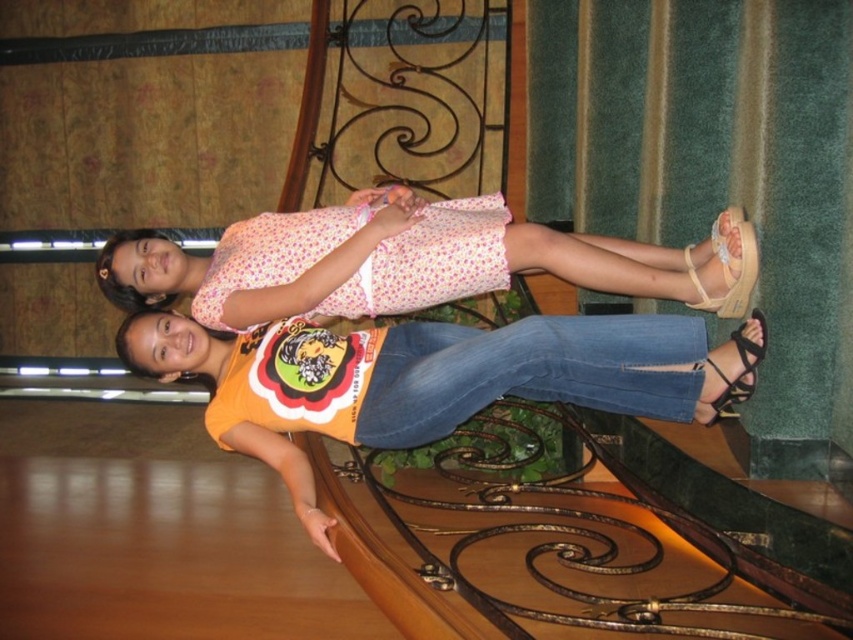
The height and width of the screenshot is (640, 853). Find the location of `pink floral dress at center`. pink floral dress at center is located at coordinates (410, 262).

Is pink floral dress at center taller than black leather sandal at lower right?

Correct, pink floral dress at center is much taller as black leather sandal at lower right.

I want to click on pink floral dress at center, so click(x=410, y=262).

This screenshot has width=853, height=640. What do you see at coordinates (432, 378) in the screenshot? I see `orange cotton t-shirt at center` at bounding box center [432, 378].

Which is behind, point (299, 426) or point (314, 228)?

Point (314, 228)

Identify the location of orange cotton t-shirt at center. Image resolution: width=853 pixels, height=640 pixels. (432, 378).

Image resolution: width=853 pixels, height=640 pixels. I want to click on orange cotton t-shirt at center, so click(x=432, y=378).

Does orange cotton t-shirt at center have a lesser width compared to beige fabric sandal at lower right?

In fact, orange cotton t-shirt at center might be wider than beige fabric sandal at lower right.

Where is `orange cotton t-shirt at center`? Image resolution: width=853 pixels, height=640 pixels. orange cotton t-shirt at center is located at coordinates (432, 378).